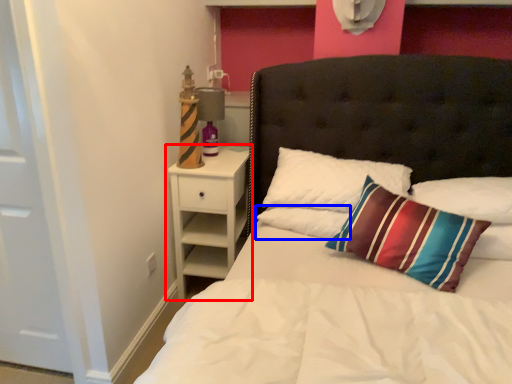
Question: Which object appears closest to the camera in this image, nightstand (highlighted by a red box) or pillow (highlighted by a blue box)?

Choices:
 (A) nightstand
 (B) pillow

Answer: (B)